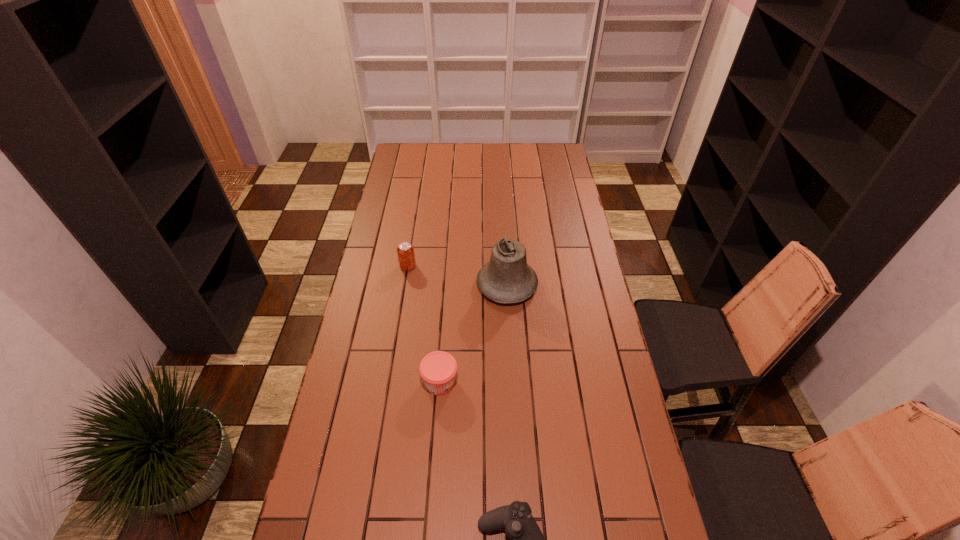
Find the location of a particular element. vacant area at the right edge is located at coordinates (550, 252).

I want to click on vacant space at the far left corner of the desktop, so (x=407, y=145).

Locate an element on the screen. The height and width of the screenshot is (540, 960). free space between the can and the tallest object is located at coordinates click(x=458, y=276).

Where is `free spot between the tallest object and the jam`? Image resolution: width=960 pixels, height=540 pixels. free spot between the tallest object and the jam is located at coordinates (473, 334).

At what (x,y) coordinates should I click in order to perform the action: click on free space between the third object from right to left and the tallest object. Please return your answer as a coordinate pair (x, y). Looking at the image, I should click on (473, 334).

Identify the location of unoccupied area between the can and the third farthest object. The image size is (960, 540). (424, 325).

You are a GUI agent. You are given a task and a screenshot of the screen. Output one action in this format:
    pyautogui.click(x=<x>, y=<y>)
    Task: Click on the blank region between the can and the jam
    The height and width of the screenshot is (540, 960).
    Given the screenshot: What is the action you would take?
    pyautogui.click(x=424, y=325)

I want to click on object that is the closest to the tallest object, so click(406, 256).

What are the coordinates of `object that is the second closest to the tallest object` in the screenshot? It's located at pos(438,369).